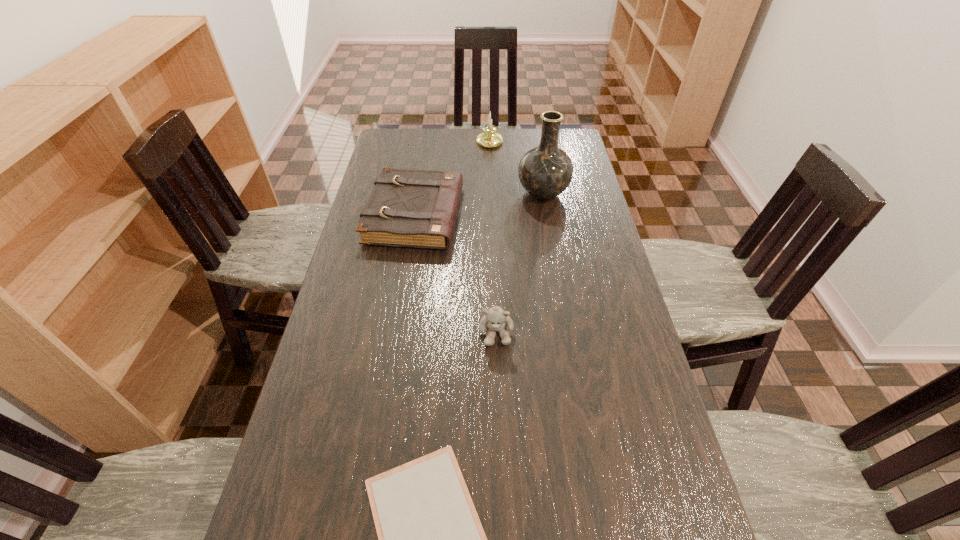
Identify the location of vacant area between the hardback book and the third tallest object. The width and height of the screenshot is (960, 540). (456, 274).

This screenshot has height=540, width=960. In order to click on free space between the farthest object and the tallest object in this screenshot , I will do `click(516, 168)`.

The width and height of the screenshot is (960, 540). I want to click on object that is the third closest to the shortest object, so click(x=545, y=171).

Choose which object is the third nearest neighbor to the fourth tallest object. Please provide its 2D coordinates. Your answer should be formatted as a tuple, i.e. [(x, y)], where the tuple contains the x and y coordinates of a point satisfying the conditions above.

[(496, 319)]

Image resolution: width=960 pixels, height=540 pixels. Identify the location of vacant region that satisfies the following two spatial constraints: 1. on the back side of the hardback book; 2. on the right side of the vase. (419, 193).

Where is `free space that satisfies the following two spatial constraints: 1. on the back side of the rightmost object; 2. on the left side of the fourth tallest object`? The width and height of the screenshot is (960, 540). free space that satisfies the following two spatial constraints: 1. on the back side of the rightmost object; 2. on the left side of the fourth tallest object is located at coordinates (419, 193).